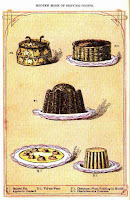
Locate an element on the screen. pink trim is located at coordinates click(x=79, y=168), click(x=103, y=173), click(x=19, y=162), click(x=30, y=145), click(x=48, y=116), click(x=78, y=118), click(x=82, y=63), click(x=103, y=64).